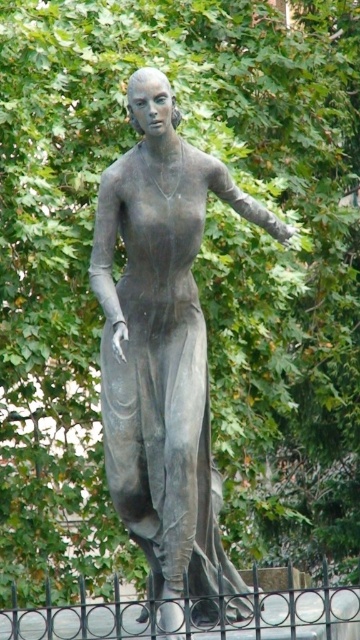
You are a painter setting up an easel to sketch the bronze statue at center and the black wrought iron fence at lower center. Based on their thickness, which object should you focus on first to ensure you capture the finer details accurately?

The bronze statue at center is thinner than the black wrought iron fence at lower center, so you should focus on the bronze statue at center first to capture its finer details accurately.

You are a painter setting up an easel to paint the bronze statue at center and the black wrought iron fence at lower center. You want to ensure your painting accurately reflects their sizes as seen from your viewpoint. Which object should you draw larger in your painting?

The bronze statue at center should be drawn larger than the black wrought iron fence at lower center because it is taller.